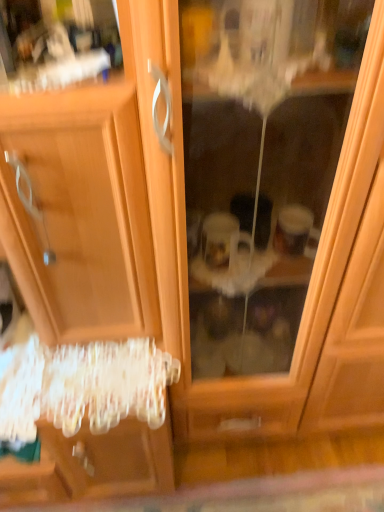
Question: Is transparent plastic screen door at left shorter than wooden dresser at left?

Choices:
 (A) no
 (B) yes

Answer: (B)

Question: Is transparent plastic screen door at left placed right next to wooden dresser at left?

Choices:
 (A) no
 (B) yes

Answer: (A)

Question: Is transparent plastic screen door at left further to the viewer compared to wooden dresser at left?

Choices:
 (A) no
 (B) yes

Answer: (B)

Question: From a real-world perspective, is transparent plastic screen door at left physically above wooden dresser at left?

Choices:
 (A) no
 (B) yes

Answer: (A)

Question: Does transparent plastic screen door at left have a lesser width compared to wooden dresser at left?

Choices:
 (A) no
 (B) yes

Answer: (B)

Question: Considering the relative positions of transparent plastic screen door at left and wooden dresser at left in the image provided, is transparent plastic screen door at left to the right of wooden dresser at left from the viewer's perspective?

Choices:
 (A) no
 (B) yes

Answer: (B)

Question: Can you confirm if wooden dresser at left is smaller than transparent plastic screen door at left?

Choices:
 (A) yes
 (B) no

Answer: (B)

Question: Can you confirm if wooden dresser at left is taller than transparent plastic screen door at left?

Choices:
 (A) no
 (B) yes

Answer: (B)

Question: Is wooden dresser at left positioned beyond the bounds of transparent plastic screen door at left?

Choices:
 (A) yes
 (B) no

Answer: (A)

Question: Is transparent plastic screen door at left completely or partially inside wooden dresser at left?

Choices:
 (A) yes
 (B) no

Answer: (B)

Question: Does wooden dresser at left have a greater width compared to transparent plastic screen door at left?

Choices:
 (A) no
 (B) yes

Answer: (B)

Question: Is wooden dresser at left facing away from transparent plastic screen door at left?

Choices:
 (A) yes
 (B) no

Answer: (B)

Question: From a real-world perspective, relative to wooden dresser at left, is transparent plastic screen door at left vertically above or below?

Choices:
 (A) above
 (B) below

Answer: (B)